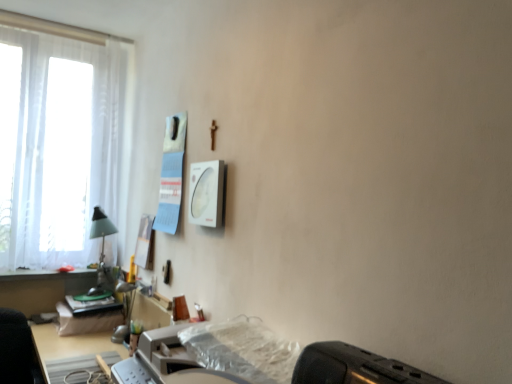
Where is `white sheer curtain at left`? white sheer curtain at left is located at coordinates (58, 146).

From a real-world perspective, is black plastic toaster at lower right located beneath transparent plastic sheet at lower center?

No, from a real-world perspective, black plastic toaster at lower right is not below transparent plastic sheet at lower center.

Locate an element on the screen. The height and width of the screenshot is (384, 512). sheet below the black plastic toaster at lower right (from the image's perspective) is located at coordinates (242, 350).

Is black plastic toaster at lower right further to the viewer compared to transparent plastic sheet at lower center?

No, it is not.

Does white sheer curtain at left appear on the right side of translucent plastic printer at lower center?

No.

Is white sheer curtain at left oriented away from translucent plastic printer at lower center?

No, white sheer curtain at left is not facing the opposite direction of translucent plastic printer at lower center.

Is white sheer curtain at left directly adjacent to translucent plastic printer at lower center?

white sheer curtain at left and translucent plastic printer at lower center are not in contact.

Looking at their sizes, would you say white sheer curtain at left is wider or thinner than translucent plastic printer at lower center?

white sheer curtain at left is thinner than translucent plastic printer at lower center.

Choose the correct answer: Is white sheer curtain at left inside transparent plastic sheet at lower center or outside it?

white sheer curtain at left is outside transparent plastic sheet at lower center.

From the image's perspective, is white sheer curtain at left beneath transparent plastic sheet at lower center?

Actually, white sheer curtain at left appears above transparent plastic sheet at lower center in the image.

Between white sheer curtain at left and transparent plastic sheet at lower center, which one is positioned behind?

white sheer curtain at left is more distant.

Considering the relative positions of white sheer curtain at left and transparent plastic sheet at lower center in the image provided, is white sheer curtain at left to the left or to the right of transparent plastic sheet at lower center?

In the image, white sheer curtain at left appears on the left side of transparent plastic sheet at lower center.

Are black plastic toaster at lower right and white sheer curtain at left far apart?

black plastic toaster at lower right is positioned a significant distance from white sheer curtain at left.

From the image's perspective, does black plastic toaster at lower right appear higher than white sheer curtain at left?

No, from the image's perspective, black plastic toaster at lower right is not over white sheer curtain at left.

Is black plastic toaster at lower right completely or partially outside of white sheer curtain at left?

black plastic toaster at lower right lies outside white sheer curtain at left's area.

From the picture: How many degrees apart are the facing directions of black plastic toaster at lower right and white sheer curtain at left?

There is a 90.8-degree angle between the facing directions of black plastic toaster at lower right and white sheer curtain at left.

In the scene shown: Which object is positioned more to the right, translucent plastic printer at lower center or white sheer curtain at left?

translucent plastic printer at lower center.

From the picture: From a real-world perspective, is translucent plastic printer at lower center on white sheer curtain at left?

Actually, translucent plastic printer at lower center is physically below white sheer curtain at left in the real world.

Is translucent plastic printer at lower center surrounding white sheer curtain at left?

That's incorrect, white sheer curtain at left is not inside translucent plastic printer at lower center.

Which is in front, translucent plastic printer at lower center or white sheer curtain at left?

translucent plastic printer at lower center.

Which object is closer to the camera taking this photo, transparent plastic sheet at lower center or black plastic toaster at lower right?

black plastic toaster at lower right is in front.

Where is `sheet behind the black plastic toaster at lower right`? Image resolution: width=512 pixels, height=384 pixels. sheet behind the black plastic toaster at lower right is located at coordinates (242, 350).

Consider the image. From a real-world perspective, is transparent plastic sheet at lower center located beneath black plastic toaster at lower right?

Yes, from a real-world perspective, transparent plastic sheet at lower center is below black plastic toaster at lower right.

Is transparent plastic sheet at lower center with black plastic toaster at lower right?

No, transparent plastic sheet at lower center is not in contact with black plastic toaster at lower right.

Considering the points (95, 60) and (327, 343), which point is behind, point (95, 60) or point (327, 343)?

Point (95, 60)

Is there a large distance between white sheer curtain at left and black plastic toaster at lower right?

Yes, white sheer curtain at left is far from black plastic toaster at lower right.

From a real-world perspective, is white sheer curtain at left physically above black plastic toaster at lower right?

Yes, from a real-world perspective, white sheer curtain at left is on top of black plastic toaster at lower right.

Which of these two, white sheer curtain at left or black plastic toaster at lower right, is thinner?

black plastic toaster at lower right is thinner.

Identify the location of sheet that appears on the left of black plastic toaster at lower right. The width and height of the screenshot is (512, 384). (242, 350).

At what (x,y) coordinates should I click in order to perform the action: click on printer located underneath the white sheer curtain at left (from a real-world perspective). Please return your answer as a coordinate pair (x, y). Looking at the image, I should click on (166, 362).

When comparing their distances from translucent plastic printer at lower center, does transparent plastic sheet at lower center or white sheer curtain at left seem further?

Based on the image, white sheer curtain at left appears to be further to translucent plastic printer at lower center.

Considering their positions, is transparent plastic sheet at lower center positioned further to white sheer curtain at left than black plastic toaster at lower right?

black plastic toaster at lower right lies further to white sheer curtain at left than the other object.

Looking at the image, which one is located further to translucent plastic printer at lower center, white sheer curtain at left or transparent plastic sheet at lower center?

The object further to translucent plastic printer at lower center is white sheer curtain at left.

When comparing their distances from black plastic toaster at lower right, does white sheer curtain at left or translucent plastic printer at lower center seem further?

Based on the image, white sheer curtain at left appears to be further to black plastic toaster at lower right.

Which object lies nearer to the anchor point black plastic toaster at lower right, translucent plastic printer at lower center or white sheer curtain at left?

translucent plastic printer at lower center lies closer to black plastic toaster at lower right than the other object.

Considering their positions, is translucent plastic printer at lower center positioned further to black plastic toaster at lower right than transparent plastic sheet at lower center?

translucent plastic printer at lower center is further to black plastic toaster at lower right.

When comparing their distances from translucent plastic printer at lower center, does white sheer curtain at left or black plastic toaster at lower right seem closer?

Among the two, black plastic toaster at lower right is located nearer to translucent plastic printer at lower center.

From the image, which object appears to be farther from translucent plastic printer at lower center, black plastic toaster at lower right or white sheer curtain at left?

white sheer curtain at left is positioned further to the anchor translucent plastic printer at lower center.

Identify the location of sheet located between translucent plastic printer at lower center and black plastic toaster at lower right in the left-right direction. (242, 350).

The height and width of the screenshot is (384, 512). What are the coordinates of `printer between black plastic toaster at lower right and white sheer curtain at left from front to back` in the screenshot? It's located at (166, 362).

Identify the location of sheet between black plastic toaster at lower right and white sheer curtain at left in the front-back direction. The height and width of the screenshot is (384, 512). (242, 350).

Identify the location of printer between transparent plastic sheet at lower center and white sheer curtain at left in the front-back direction. (166, 362).